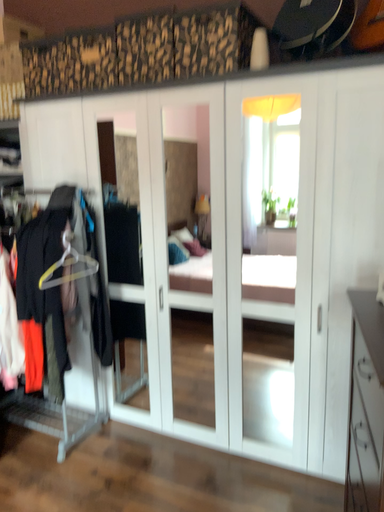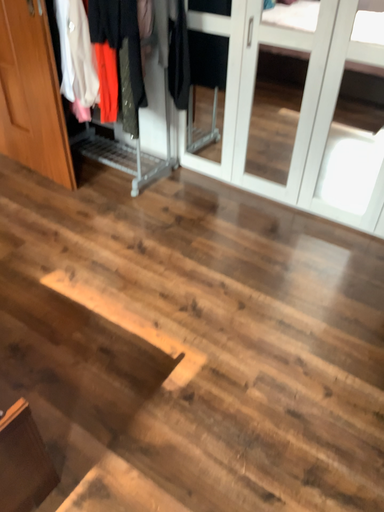
Question: How did the camera likely rotate when shooting the video?

Choices:
 (A) rotated right
 (B) rotated left

Answer: (B)